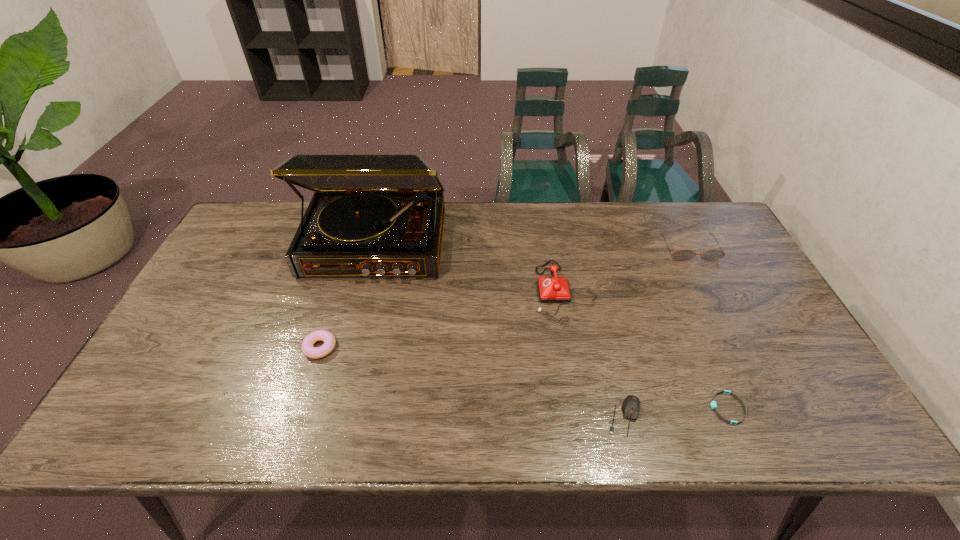
Image resolution: width=960 pixels, height=540 pixels. Find the location of `object that is the fourth closest to the shortest object`. object that is the fourth closest to the shortest object is located at coordinates click(371, 215).

At what (x,y) coordinates should I click in order to perform the action: click on object identified as the second closest to the fourth farthest object. Please return your answer as a coordinate pair (x, y). This screenshot has height=540, width=960. Looking at the image, I should click on (551, 289).

Image resolution: width=960 pixels, height=540 pixels. What are the coordinates of `blank area in the image that satisfies the following two spatial constraints: 1. on the dial of the mouse; 2. on the right side of the fifth shortest object` in the screenshot? It's located at (588, 416).

Where is `free space that satisfies the following two spatial constraints: 1. on the face of the sunglasses; 2. on the dial of the telephone`? free space that satisfies the following two spatial constraints: 1. on the face of the sunglasses; 2. on the dial of the telephone is located at coordinates (710, 292).

I want to click on vacant area that satisfies the following two spatial constraints: 1. on the dial of the telephone; 2. on the back side of the mouse, so click(588, 416).

Where is `vacant region that satisfies the following two spatial constraints: 1. on the face of the sunglasses; 2. on the dial of the second tallest object`? Image resolution: width=960 pixels, height=540 pixels. vacant region that satisfies the following two spatial constraints: 1. on the face of the sunglasses; 2. on the dial of the second tallest object is located at coordinates (710, 292).